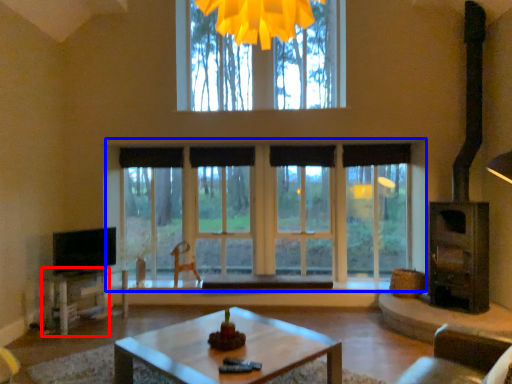
Question: Which of the following is the farthest to the observer, table (highlighted by a red box) or window (highlighted by a blue box)?

Choices:
 (A) table
 (B) window

Answer: (B)